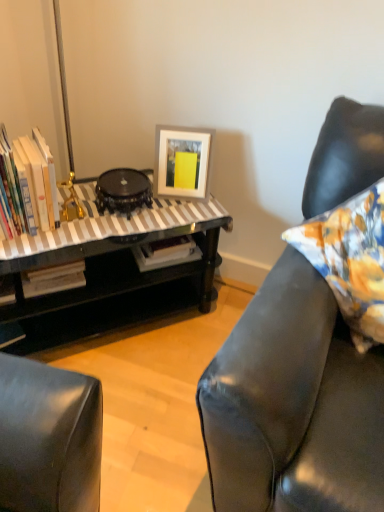
The width and height of the screenshot is (384, 512). Identify the location of vacant space in between black glossy round table at center and white matte picture frame at upper center. (179, 206).